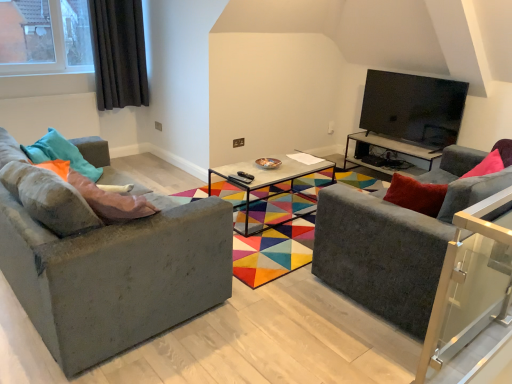
Question: In the image, is concrete textured coffee table at center on the left side or the right side of dark grey fabric curtain at upper left?

Choices:
 (A) left
 (B) right

Answer: (B)

Question: Is concrete textured coffee table at center situated inside dark grey fabric curtain at upper left or outside?

Choices:
 (A) inside
 (B) outside

Answer: (B)

Question: Which of these objects is positioned closest to the dark gray fabric couch at right, acting as the first studio couch starting from the right?

Choices:
 (A) concrete textured coffee table at center
 (B) dark grey fabric curtain at upper left
 (C) textured gray couch at left, acting as the first studio couch starting from the left
 (D) black glossy tv at upper right
 (E) pink fabric pillow at left, the 2th pillow when ordered from left to right

Answer: (C)

Question: Which object is positioned closest to the teal fabric pillow at left, the 1th pillow positioned from the left?

Choices:
 (A) metallic black coffee table at center
 (B) black glossy tv at upper right
 (C) pink fabric pillow at left, the 2th pillow when ordered from left to right
 (D) textured gray couch at left, acting as the first studio couch starting from the left
 (E) dark gray fabric couch at right, acting as the first studio couch starting from the right

Answer: (C)